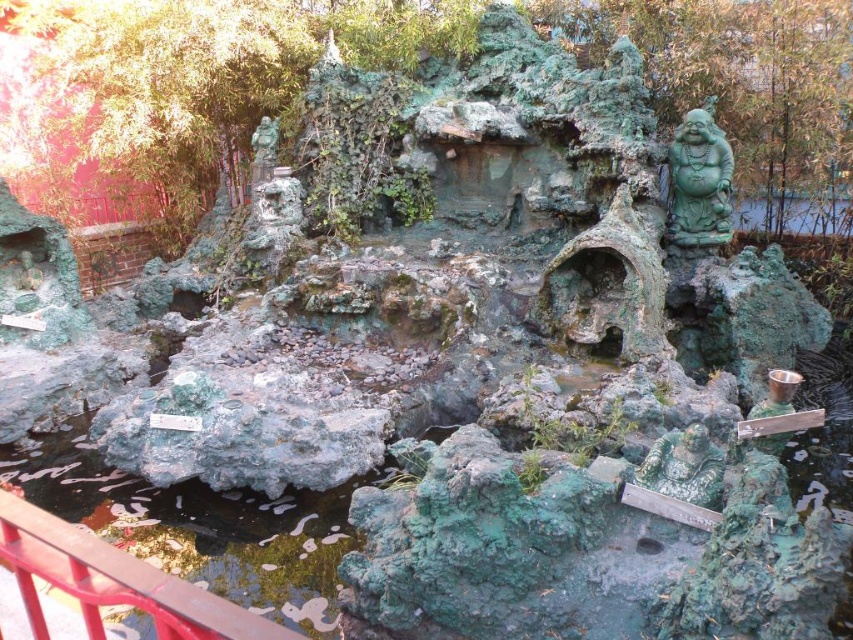
You are standing in the miniature garden and want to walk from the red metal railing at lower left to the green patina statue at lower right. Which direction should you move?

You should move to the right because the red metal railing at lower left is to the left of the green patina statue at lower right.

You are standing at the entrance of the miniature landscape garden. You need to locate the red metal railing at lower left. According to the coordinates provided, where exactly is it positioned?

The red metal railing at lower left is positioned at coordinates point (113,580).